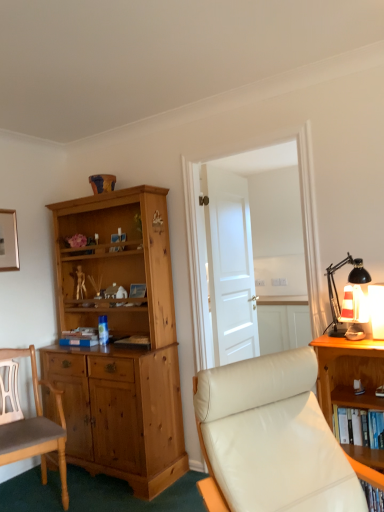
Where is `free point below striped fabric lampshade at right (from a real-world perspective)`? The height and width of the screenshot is (512, 384). free point below striped fabric lampshade at right (from a real-world perspective) is located at coordinates (353, 339).